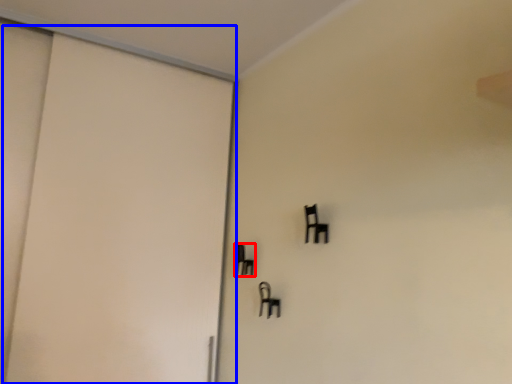
Question: Which object appears farthest to the camera in this image, furniture (highlighted by a red box) or door (highlighted by a blue box)?

Choices:
 (A) furniture
 (B) door

Answer: (A)